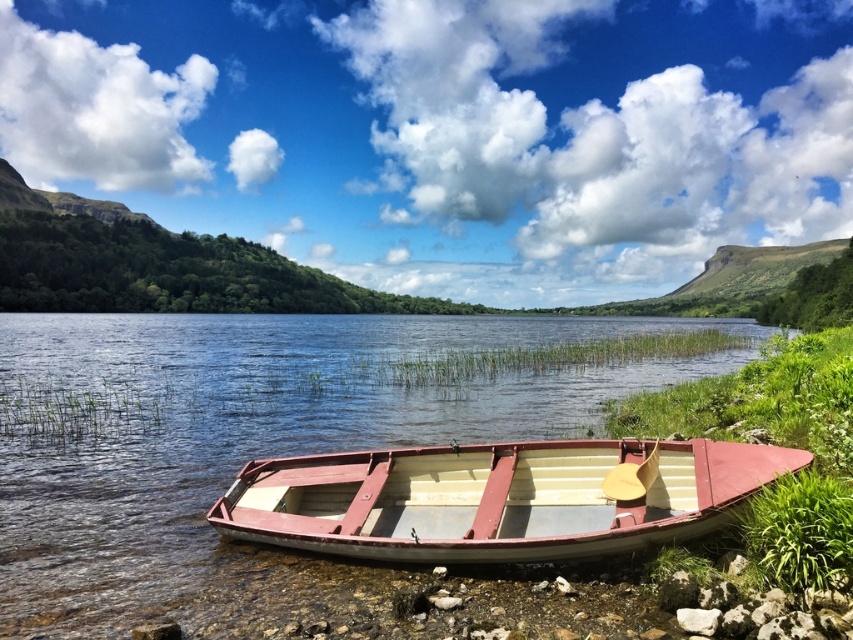
You are planning to row the white wooden boat at lower center across the white glossy water at center. Based on their widths, can the boat fit comfortably on the water surface?

The white glossy water at center might be wider than the white wooden boat at lower center, so the boat should fit comfortably on the water surface.

You are standing at the lakeside and want to reach the white glossy water at center. According to the coordinates provided, in which direction should you move from your current position to reach it?

The white glossy water at center is located at coordinates point (247, 445). Since the coordinates are relative to the image, moving towards the center area would guide you towards it.